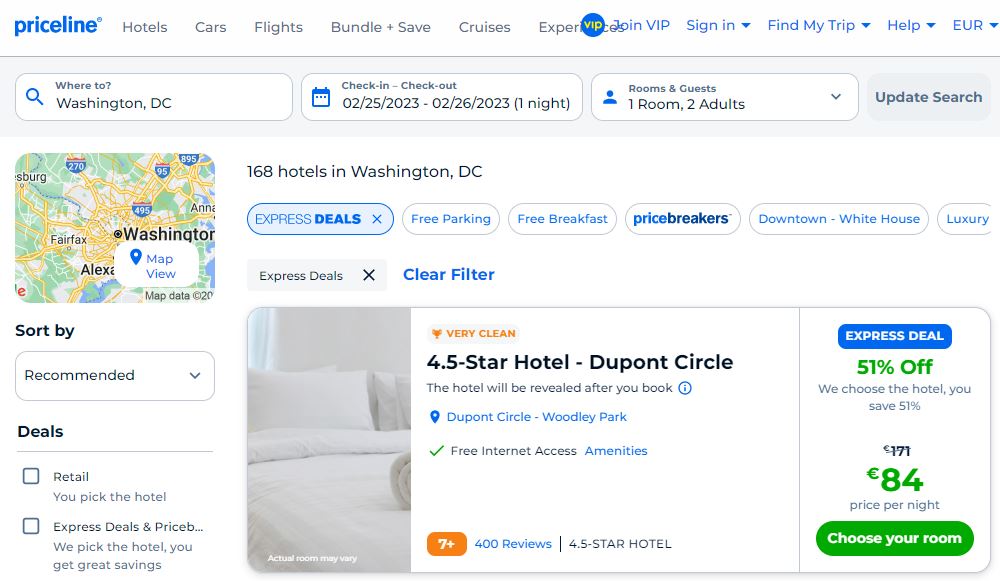
Locate an element on the screen. map is located at coordinates (101, 207).